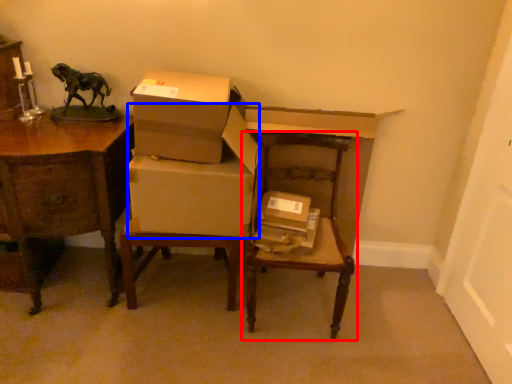
Question: Which object is further to the camera taking this photo, chair (highlighted by a red box) or cardboard box (highlighted by a blue box)?

Choices:
 (A) chair
 (B) cardboard box

Answer: (B)